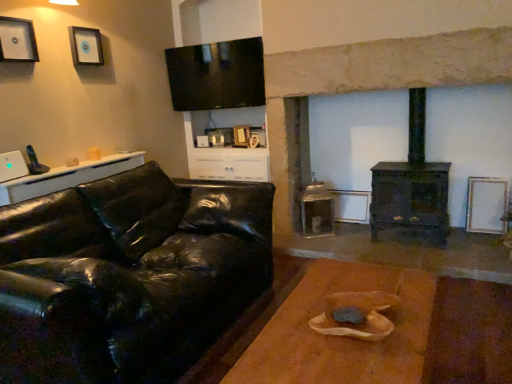
Image resolution: width=512 pixels, height=384 pixels. In order to click on brown wooden table at center, the first table in the right-to-left sequence in this screenshot , I will do `click(342, 337)`.

This screenshot has width=512, height=384. I want to click on wooden picture frame at upper left, the 2th picture frame positioned from the front, so click(x=86, y=46).

What do you see at coordinates (487, 205) in the screenshot? The width and height of the screenshot is (512, 384). I see `white matte picture frame at right, the 3th picture frame positioned from the front` at bounding box center [487, 205].

I want to click on white matte picture frame at right, the 3th picture frame positioned from the front, so click(487, 205).

In order to face matte black cabinet at upper center, should I rotate leftwards or rightwards?

A 3.111 degree turn to the left will do.

At what (x,y) coordinates should I click in order to perform the action: click on black leather couch at left. Please return your answer as a coordinate pair (x, y). The width and height of the screenshot is (512, 384). Looking at the image, I should click on (128, 276).

Find the location of a particular element. The width and height of the screenshot is (512, 384). table on the left of brown wooden table at center, the 1th table from the front is located at coordinates (67, 177).

Is white glossy table at left, which is the second table from bottom to top, oriented towards brown wooden table at center, the first table in the right-to-left sequence?

No.

In the scene shown: From the image's perspective, is white glossy table at left, acting as the 2th table starting from the front, above brown wooden table at center, the 2th table in the back-to-front sequence?

Yes.

Between white glossy table at left, positioned as the second table in right-to-left order, and brown wooden table at center, the 2th table in the back-to-front sequence, which one is positioned in front?

brown wooden table at center, the 2th table in the back-to-front sequence, is closer to the camera.

Can you confirm if white matte picture frame at right, marked as the 1th picture frame in a back-to-front arrangement, is taller than black leather couch at left?

No, white matte picture frame at right, marked as the 1th picture frame in a back-to-front arrangement, is not taller than black leather couch at left.

Is white matte picture frame at right, the 3th picture frame positioned from the front, positioned beyond the bounds of black leather couch at left?

Yes, white matte picture frame at right, the 3th picture frame positioned from the front, is located beyond the bounds of black leather couch at left.

From a real-world perspective, is white matte picture frame at right, the 3th picture frame positioned from the front, physically located above or below black leather couch at left?

In terms of real-world spatial position, white matte picture frame at right, the 3th picture frame positioned from the front, is below black leather couch at left.

Is white matte picture frame at right, marked as the 1th picture frame in a back-to-front arrangement, aimed at black leather couch at left?

No, white matte picture frame at right, marked as the 1th picture frame in a back-to-front arrangement, is not turned towards black leather couch at left.

Locate an element on the screen. table that is the 2nd one below the matte black cabinet at upper center (from a real-world perspective) is located at coordinates (342, 337).

Is matte black cabinet at upper center not within brown wooden table at center, placed as the 1th table when sorted from bottom to top?

That's correct, matte black cabinet at upper center is outside of brown wooden table at center, placed as the 1th table when sorted from bottom to top.

Considering the sizes of objects matte black cabinet at upper center and brown wooden table at center, placed as the 1th table when sorted from bottom to top, in the image provided, who is taller, matte black cabinet at upper center or brown wooden table at center, placed as the 1th table when sorted from bottom to top,?

With more height is matte black cabinet at upper center.

Considering the sizes of matte black cabinet at upper center and brown wooden table at center, marked as the second table in a left-to-right arrangement, in the image, is matte black cabinet at upper center wider or thinner than brown wooden table at center, marked as the second table in a left-to-right arrangement,?

In the image, matte black cabinet at upper center appears to be more narrow than brown wooden table at center, marked as the second table in a left-to-right arrangement.

Is black leather couch at left surrounding wooden picture frame at upper left, the first picture frame in the top-to-bottom sequence?

Definitely not — wooden picture frame at upper left, the first picture frame in the top-to-bottom sequence, is not inside black leather couch at left.

Considering the positions of objects black leather couch at left and wooden picture frame at upper left, which is the 3th picture frame from bottom to top, in the image provided, who is more to the right, black leather couch at left or wooden picture frame at upper left, which is the 3th picture frame from bottom to top,?

black leather couch at left is more to the right.

Is black leather couch at left positioned with its back to wooden picture frame at upper left, the first picture frame in the top-to-bottom sequence?

No, wooden picture frame at upper left, the first picture frame in the top-to-bottom sequence, is not at the back of black leather couch at left.

Who is bigger, black leather couch at left or wooden picture frame at upper left, the 2th picture frame positioned from the front?

black leather couch at left.

Is brushed metal picture frame at upper left, the 2th picture frame positioned from the top, facing towards white glossy table at left, acting as the 1th table starting from the back?

No.

Is brushed metal picture frame at upper left, which ranks as the third picture frame in right-to-left order, to the left of white glossy table at left, positioned as the second table in right-to-left order, from the viewer's perspective?

Yes.

Considering the sizes of objects brushed metal picture frame at upper left, which ranks as the third picture frame in right-to-left order, and white glossy table at left, which is the 1th table from top to bottom, in the image provided, who is wider, brushed metal picture frame at upper left, which ranks as the third picture frame in right-to-left order, or white glossy table at left, which is the 1th table from top to bottom,?

white glossy table at left, which is the 1th table from top to bottom.

Between brushed metal picture frame at upper left, positioned as the first picture frame in left-to-right order, and white glossy table at left, which is the 1th table from top to bottom, which one has larger size?

white glossy table at left, which is the 1th table from top to bottom.

Looking at their sizes, would you say brown wooden table at center, the first table in the right-to-left sequence, is wider or thinner than brushed metal picture frame at upper left, positioned as the first picture frame in left-to-right order?

Considering their sizes, brown wooden table at center, the first table in the right-to-left sequence, looks broader than brushed metal picture frame at upper left, positioned as the first picture frame in left-to-right order.

Does brown wooden table at center, the second table viewed from the top, have a larger size compared to brushed metal picture frame at upper left, positioned as the first picture frame in left-to-right order?

Correct, brown wooden table at center, the second table viewed from the top, is larger in size than brushed metal picture frame at upper left, positioned as the first picture frame in left-to-right order.

Find the location of a particular element. the 1st picture frame behind the brown wooden table at center, marked as the second table in a left-to-right arrangement, starting your count from the anchor is located at coordinates (17, 40).

Based on the photo, would you say brown wooden table at center, placed as the 1th table when sorted from bottom to top, contains brushed metal picture frame at upper left, which is the second picture frame from bottom to top?

No, brown wooden table at center, placed as the 1th table when sorted from bottom to top, does not contain brushed metal picture frame at upper left, which is the second picture frame from bottom to top.

Is white matte picture frame at right, the 3th picture frame positioned from the front, at the back of black leather couch at left?

No, white matte picture frame at right, the 3th picture frame positioned from the front, is not at the back of black leather couch at left.

Is the surface of black leather couch at left in direct contact with white matte picture frame at right, which appears as the third picture frame when viewed from the top?

No.

From a real-world perspective, is black leather couch at left physically located above or below white matte picture frame at right, marked as the 1th picture frame in a back-to-front arrangement?

Clearly, from a real-world perspective, black leather couch at left is above white matte picture frame at right, marked as the 1th picture frame in a back-to-front arrangement.

Does black leather couch at left have a larger size compared to white matte picture frame at right, which is the first picture frame in right-to-left order?

Correct, black leather couch at left is larger in size than white matte picture frame at right, which is the first picture frame in right-to-left order.

Locate an element on the screen. table on the right of white glossy table at left, positioned as the second table in right-to-left order is located at coordinates (342, 337).

Where is `studio couch below the white matte picture frame at right, which appears as the third picture frame when viewed from the top (from the image's perspective)`? Image resolution: width=512 pixels, height=384 pixels. studio couch below the white matte picture frame at right, which appears as the third picture frame when viewed from the top (from the image's perspective) is located at coordinates (128, 276).

Looking at the image, which one is located further to white glossy table at left, which is the 1th table from top to bottom, wooden picture frame at upper left, marked as the second picture frame in a left-to-right arrangement, or brown wooden table at center, the second table viewed from the top?

Based on the image, brown wooden table at center, the second table viewed from the top, appears to be further to white glossy table at left, which is the 1th table from top to bottom.

When comparing their distances from matte black cabinet at upper center, does black leather couch at left or white glossy table at left, acting as the 1th table starting from the back, seem closer?

Based on the image, white glossy table at left, acting as the 1th table starting from the back, appears to be nearer to matte black cabinet at upper center.

Which object lies further to the anchor point white glossy table at left, acting as the 1th table starting from the back, brown wooden table at center, placed as the 1th table when sorted from bottom to top, or white matte picture frame at right, marked as the 1th picture frame in a back-to-front arrangement?

white matte picture frame at right, marked as the 1th picture frame in a back-to-front arrangement, is further to white glossy table at left, acting as the 1th table starting from the back.

From the image, which object appears to be farther from matte black cabinet at upper center, brushed metal picture frame at upper left, which is the second picture frame from bottom to top, or black leather couch at left?

Based on the image, brushed metal picture frame at upper left, which is the second picture frame from bottom to top, appears to be further to matte black cabinet at upper center.

Estimate the real-world distances between objects in this image. Which object is closer to wooden picture frame at upper left, the first picture frame in the top-to-bottom sequence, white glossy table at left, which is the first table from left to right, or matte black cabinet at upper center?

The object closer to wooden picture frame at upper left, the first picture frame in the top-to-bottom sequence, is white glossy table at left, which is the first table from left to right.

Which object lies further to the anchor point brushed metal picture frame at upper left, which appears as the 1th picture frame when viewed from the front, white matte picture frame at right, marked as the 1th picture frame in a back-to-front arrangement, or matte black cabinet at upper center?

white matte picture frame at right, marked as the 1th picture frame in a back-to-front arrangement.

Which object lies nearer to the anchor point black leather couch at left, brown wooden table at center, the second table viewed from the top, or white matte picture frame at right, marked as the first picture frame in a bottom-to-top arrangement?

The object closer to black leather couch at left is brown wooden table at center, the second table viewed from the top.

From the image, which object appears to be farther from brown wooden table at center, the 2th table in the back-to-front sequence, wooden picture frame at upper left, the first picture frame in the top-to-bottom sequence, or matte black cabinet at upper center?

wooden picture frame at upper left, the first picture frame in the top-to-bottom sequence, is further to brown wooden table at center, the 2th table in the back-to-front sequence.

Where is `table situated between wooden picture frame at upper left, marked as the second picture frame in a left-to-right arrangement, and white matte picture frame at right, which appears as the third picture frame when viewed from the top, from left to right`? Image resolution: width=512 pixels, height=384 pixels. table situated between wooden picture frame at upper left, marked as the second picture frame in a left-to-right arrangement, and white matte picture frame at right, which appears as the third picture frame when viewed from the top, from left to right is located at coordinates (342, 337).

The width and height of the screenshot is (512, 384). In order to click on picture frame that lies between wooden picture frame at upper left, marked as the second picture frame in a back-to-front arrangement, and white glossy table at left, which is the 1th table from top to bottom, from top to bottom in this screenshot , I will do `click(17, 40)`.

Image resolution: width=512 pixels, height=384 pixels. What are the coordinates of `picture frame situated between white glossy table at left, acting as the 1th table starting from the back, and matte black cabinet at upper center from left to right` in the screenshot? It's located at (86, 46).

I want to click on studio couch between brown wooden table at center, the 2th table in the back-to-front sequence, and matte black cabinet at upper center in the front-back direction, so click(x=128, y=276).